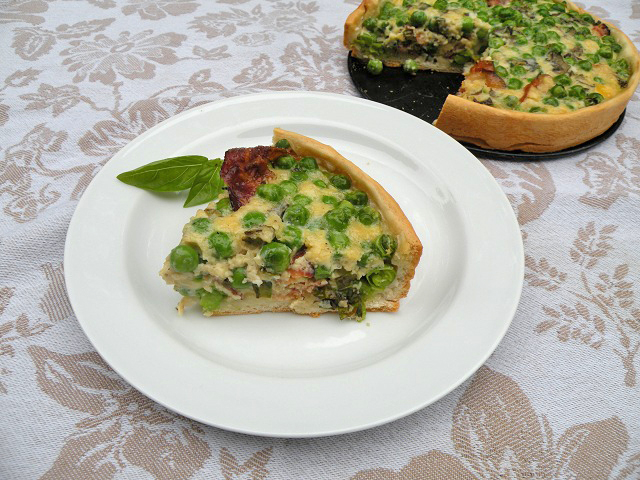
Identify the location of black plate. The image size is (640, 480). (564, 152).